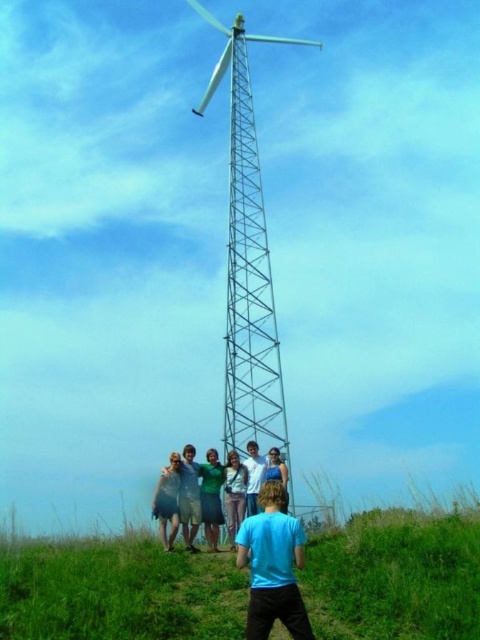
Question: In this image, where is green fabric group at center located relative to white shirt at center?

Choices:
 (A) right
 (B) left

Answer: (B)

Question: Considering the relative positions of green fabric group at center and white shirt at center in the image provided, where is green fabric group at center located with respect to white shirt at center?

Choices:
 (A) above
 (B) below

Answer: (B)

Question: Which object appears closest to the camera in this image?

Choices:
 (A) green fabric shirt at center
 (B) green grassy hillside at lower center
 (C) white shirt at center

Answer: (B)

Question: Which of these objects is positioned farthest from the light blue shirt at center?

Choices:
 (A) white shirt at center
 (B) green fabric shirt at center
 (C) blue denim jeans at lower center
 (D) metallic silver tower at center

Answer: (D)

Question: Is green fabric group at center below light blue shirt at lower center?

Choices:
 (A) no
 (B) yes

Answer: (A)

Question: Which of the following is the closest to the observer?

Choices:
 (A) green fabric group at center
 (B) blue t-shirt at lower center
 (C) white shirt at center
 (D) metallic silver tower at center

Answer: (B)